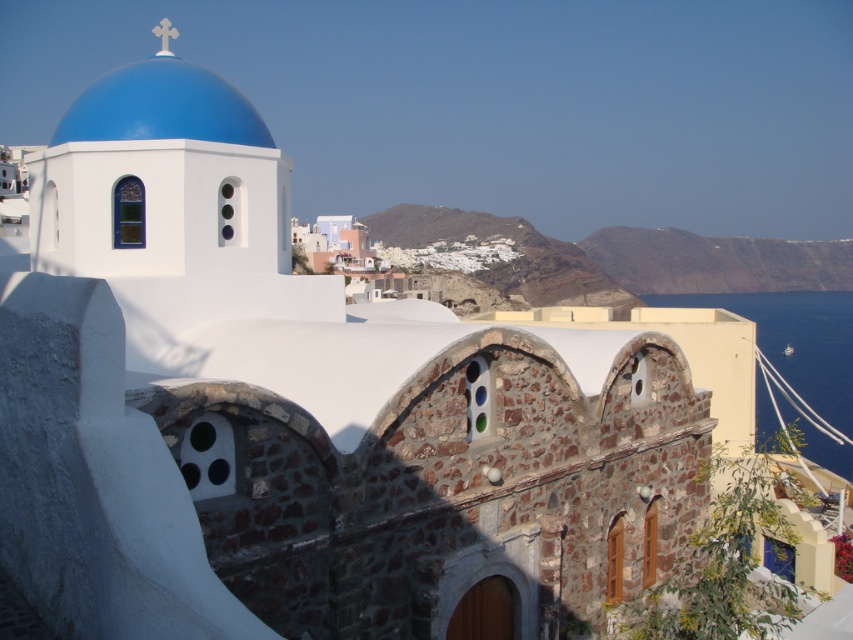
Looking at this image, does blue water at right have a greater height compared to blue painted dome at upper left?

Yes, blue water at right is taller than blue painted dome at upper left.

Measure the distance between blue water at right and blue painted dome at upper left.

blue water at right is 1020.86 feet from blue painted dome at upper left.

Locate an element on the screen. This screenshot has width=853, height=640. blue water at right is located at coordinates (796, 340).

Where is `blue water at right`? The height and width of the screenshot is (640, 853). blue water at right is located at coordinates (796, 340).